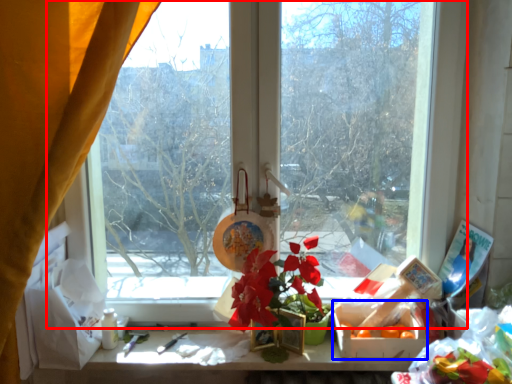
Question: Which of the following is the closest to the observer, window (highlighted by a red box) or flower box (highlighted by a blue box)?

Choices:
 (A) window
 (B) flower box

Answer: (B)